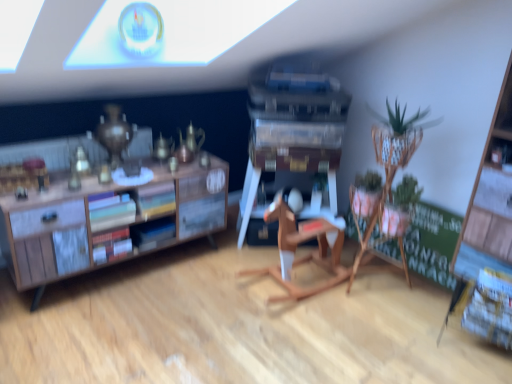
I want to click on vacant region in front of wooden rocking horse at center, so [x=302, y=342].